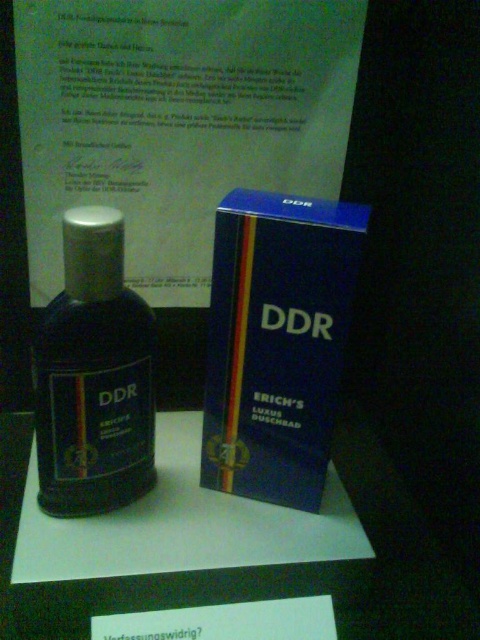
Question: Which of the following is the closest to the observer?

Choices:
 (A) matte black bottle at center
 (B) blue matte box at center
 (C) white paper at center

Answer: (B)

Question: Among these objects, which one is farthest from the camera?

Choices:
 (A) white paper at center
 (B) blue matte box at center
 (C) matte black bottle at center

Answer: (A)

Question: Is blue matte box at center positioned at the back of matte black bottle at center?

Choices:
 (A) yes
 (B) no

Answer: (B)

Question: Does matte black bottle at center appear under white paper at center?

Choices:
 (A) yes
 (B) no

Answer: (B)

Question: Is blue matte box at center closer to camera compared to matte black bottle at center?

Choices:
 (A) yes
 (B) no

Answer: (A)

Question: Which point appears closest to the camera in this image?

Choices:
 (A) (96, 600)
 (B) (310, 408)
 (C) (90, 451)

Answer: (A)